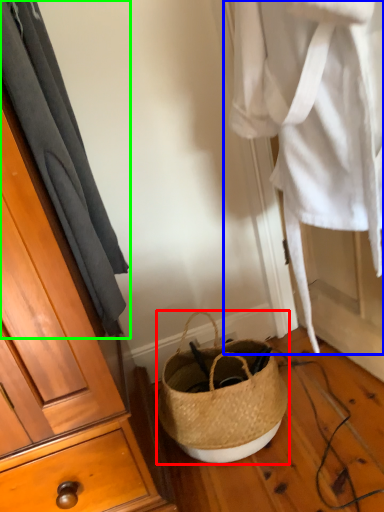
Question: Based on their relative distances, which object is nearer to handbag (highlighted by a red box)? Choose from clothing (highlighted by a blue box) and curtain (highlighted by a green box).

Choices:
 (A) clothing
 (B) curtain

Answer: (A)